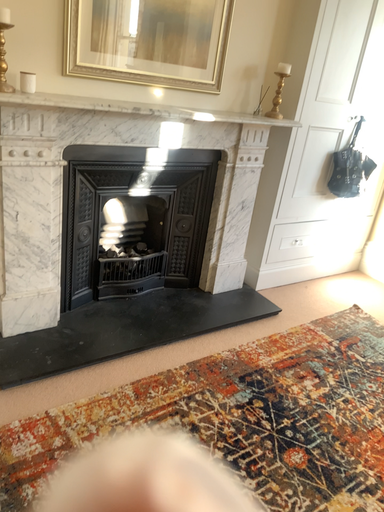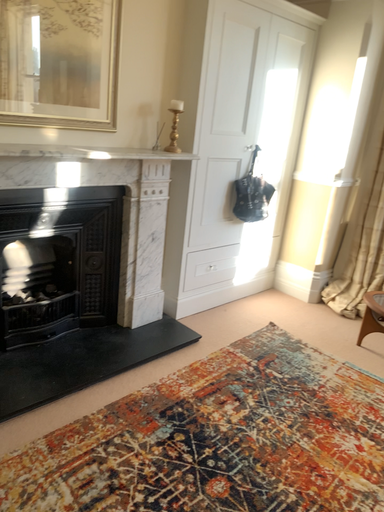
Question: Which way did the camera rotate in the video?

Choices:
 (A) rotated right
 (B) rotated left

Answer: (A)